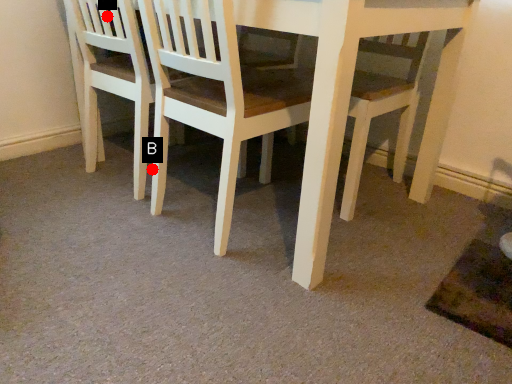
Question: Two points are circled on the image, labeled by A and B beside each circle. Which point is closer to the camera taking this photo?

Choices:
 (A) A is closer
 (B) B is closer

Answer: (A)